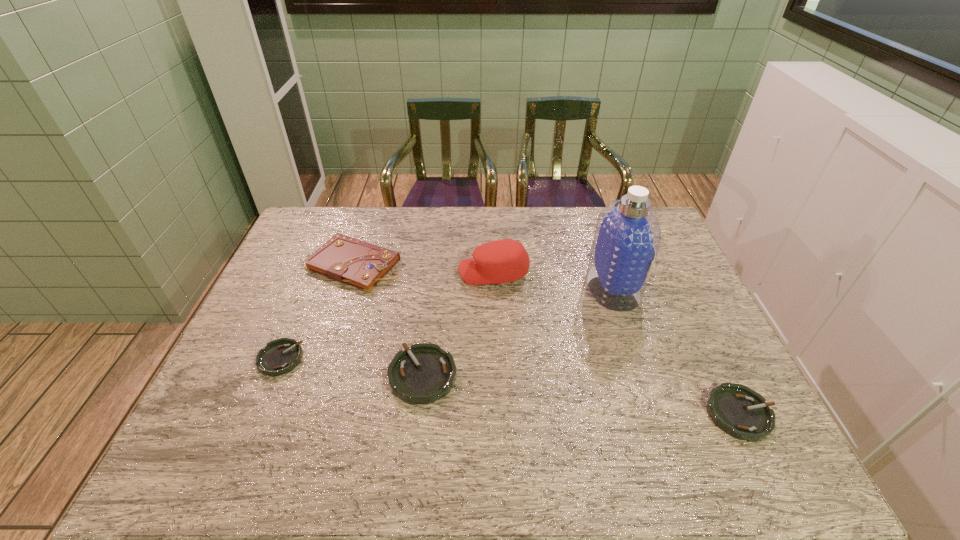
Please mark a free spot for a new ashtray to balance the arrangement. Please provide its 2D coordinates. Your answer should be formatted as a tuple, i.e. [(x, y)], where the tuple contains the x and y coordinates of a point satisfying the conditions above.

[(576, 394)]